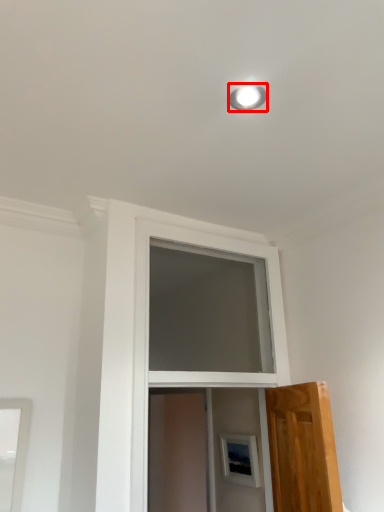
Question: From the image's perspective, what is the correct spatial positioning of lighting (annotated by the red box) in reference to screen door?

Choices:
 (A) above
 (B) below

Answer: (A)